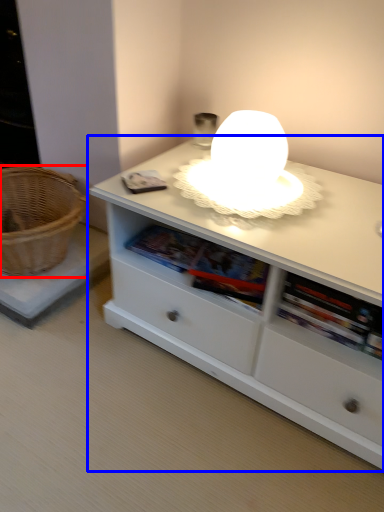
Question: Which of the following is the farthest to the observer, basket (highlighted by a red box) or table (highlighted by a blue box)?

Choices:
 (A) basket
 (B) table

Answer: (A)